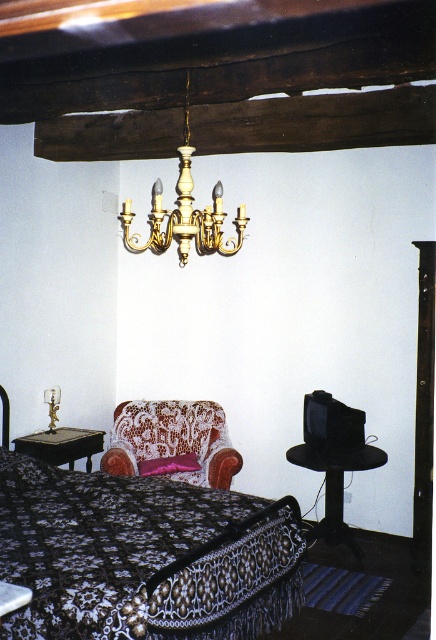
Who is positioned more to the left, velvet floral armchair at lower center or gold polished chandelier at upper center?

velvet floral armchair at lower center is more to the left.

The image size is (436, 640). Find the location of `velvet floral armchair at lower center`. velvet floral armchair at lower center is located at coordinates (173, 442).

You are a GUI agent. You are given a task and a screenshot of the screen. Output one action in this format:
    pyautogui.click(x=<x>, y=<y>)
    Task: Click on the velvet floral armchair at lower center
    The image size is (436, 640).
    Given the screenshot: What is the action you would take?
    pyautogui.click(x=173, y=442)

Image resolution: width=436 pixels, height=640 pixels. What do you see at coordinates (173, 442) in the screenshot? I see `velvet floral armchair at lower center` at bounding box center [173, 442].

Which is behind, point (113, 424) or point (173, 456)?

Point (113, 424)

Identify the location of velvet floral armchair at lower center. (173, 442).

What are the coordinates of `velvet floral armchair at lower center` in the screenshot? It's located at (173, 442).

Is point (128, 515) farther from viewer compared to point (179, 464)?

That is False.

Where is `black lace bed at center`? This screenshot has width=436, height=640. black lace bed at center is located at coordinates click(140, 556).

Locate an element on the screen. black lace bed at center is located at coordinates (140, 556).